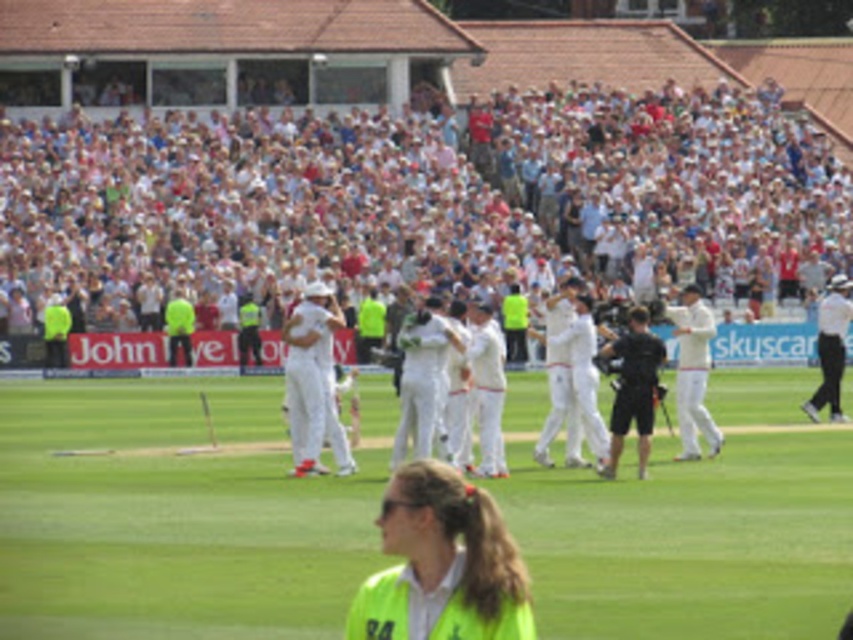
Consider the image. Is white cotton cricket uniform at center closer to camera compared to white clothed figure at right?

Yes, white cotton cricket uniform at center is in front of white clothed figure at right.

Is point (410, 358) more distant than point (828, 381)?

No, it is in front of (828, 381).

Which is in front, point (409, 328) or point (836, 374)?

Point (409, 328) is in front.

Where is `white cotton cricket uniform at center`? white cotton cricket uniform at center is located at coordinates (422, 378).

Is yellow reflective vest at lower center taller than white cotton cricket uniform at center?

No.

Who is taller, yellow reflective vest at lower center or white cotton cricket uniform at center?

white cotton cricket uniform at center is taller.

Which is in front, point (432, 531) or point (444, 396)?

Positioned in front is point (432, 531).

Find the location of a particular element. This screenshot has width=853, height=640. yellow reflective vest at lower center is located at coordinates (442, 564).

Is point (733, 241) closer to viewer compared to point (405, 403)?

No, it is not.

Does white cloth crowd at upper center have a lesser height compared to white cotton cricket uniform at center?

Incorrect, white cloth crowd at upper center's height does not fall short of white cotton cricket uniform at center's.

Is point (723, 269) less distant than point (434, 376)?

No, (723, 269) is behind (434, 376).

Locate an element on the screen. white cloth crowd at upper center is located at coordinates (x=419, y=205).